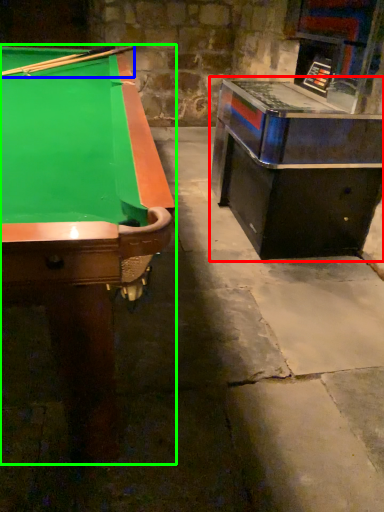
Question: Based on their relative distances, which object is farther from table (highlighted by a red box)? Choose from cue (highlighted by a blue box) and billiard table (highlighted by a green box).

Choices:
 (A) cue
 (B) billiard table

Answer: (A)